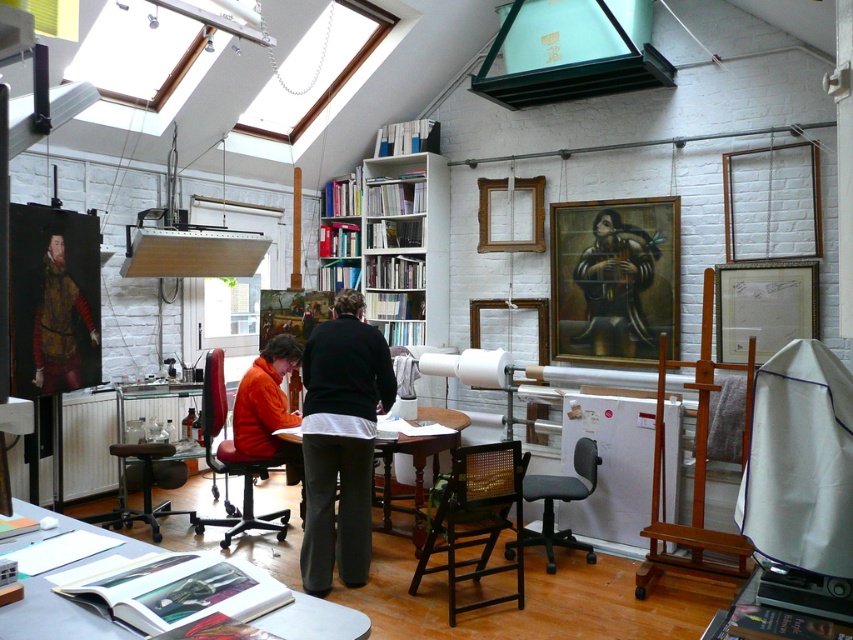
You are standing in the studio and want to take a photo of both point [468,522] and point [569,492]. Which point should you focus on first to ensure both are in clear view?

You should focus on point [468,522] first because it is closer to the camera than point [569,492]. This ensures both points will be in focus as the depth of field will cover the distance between them.

You are an artist standing at the wooden table at lower center and want to move to the matte gold armor at left to adjust its position. Considering the space between them, can you easily walk around the table to reach the armor?

The wooden table at lower center is in front of the matte gold armor at left, so you would need to move around the table to access the armor. Since the table is in front, you can walk around it to reach the armor easily.

You are a person who is 1.8 meters tall and want to sit comfortably at a desk in the studio. The desk is positioned between the wooden chair at center and the leather office chair at lower left. Which chair should you choose to ensure your feet can comfortably touch the floor?

The wooden chair at center has a lesser height compared to the leather office chair at lower left. Since you are 1.8 meters tall, choosing the wooden chair at center would provide a lower seat height, allowing your feet to comfortably touch the floor.